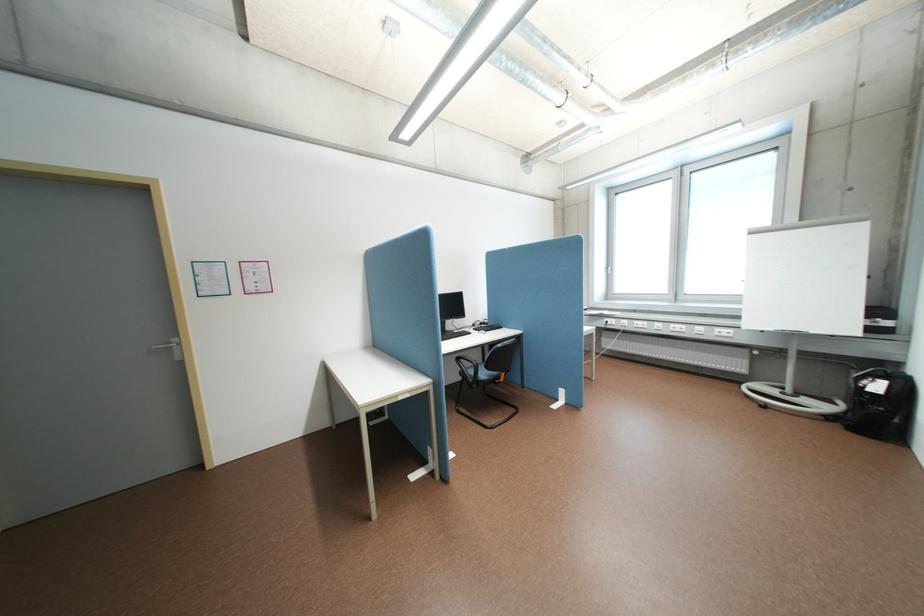
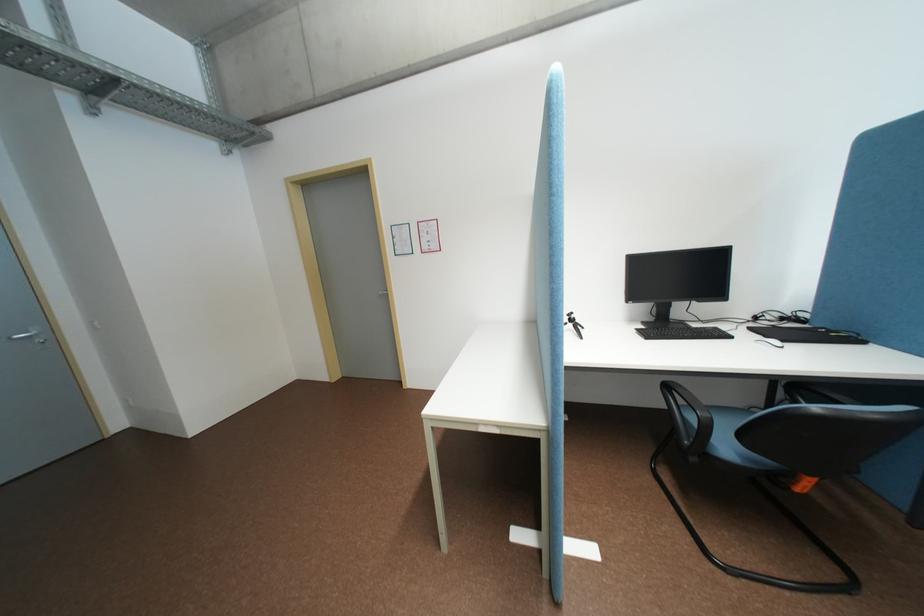
Find the pixel in the second image that matches [468,359] in the first image.

(677, 386)